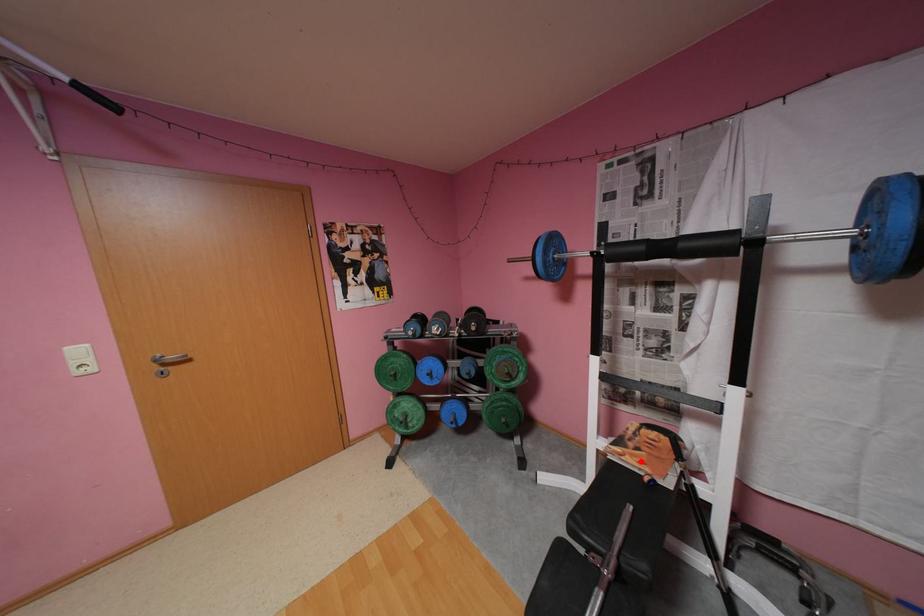
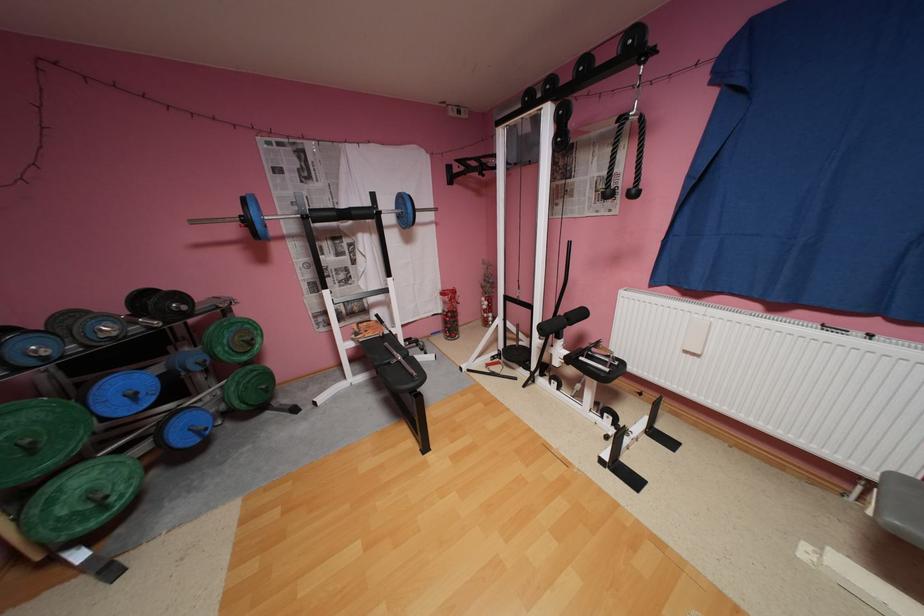
Question: I am providing you with two images of the same scene from different viewpoints. Image1 has a red point marked. In image2, the corresponding 3D location appears at what relative position? Reply with the corresponding letter.

Choices:
 (A) Closer
 (B) Farther

Answer: (A)